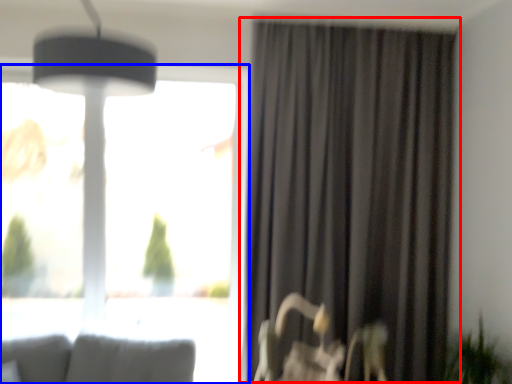
Question: Which object appears closest to the camera in this image, curtain (highlighted by a red box) or window (highlighted by a blue box)?

Choices:
 (A) curtain
 (B) window

Answer: (A)